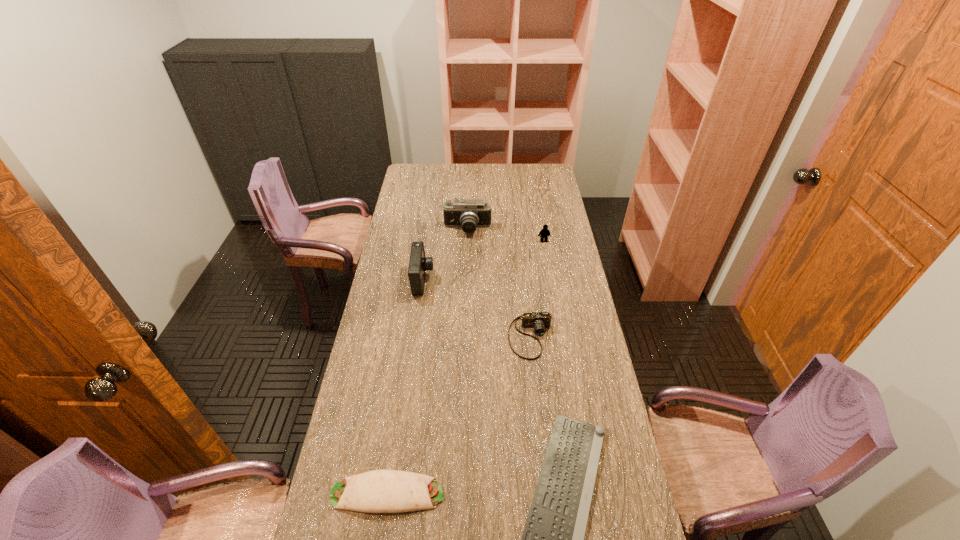
Image resolution: width=960 pixels, height=540 pixels. What are the coordinates of `vacant space situated on the front-facing side of the third farthest object` in the screenshot? It's located at click(503, 280).

Identify the location of free space located 0.340m on the face of the Lego. Image resolution: width=960 pixels, height=540 pixels. pos(553,298).

Identify the location of vacant space situated 0.150m on the front-facing side of the third nearest object. This screenshot has height=540, width=960. (538, 400).

Where is `blank area located at the bitten end of the burrito`? The width and height of the screenshot is (960, 540). blank area located at the bitten end of the burrito is located at coordinates (562, 493).

Locate an element on the screen. The width and height of the screenshot is (960, 540). camera that is at the left edge is located at coordinates (418, 264).

You are a GUI agent. You are given a task and a screenshot of the screen. Output one action in this format:
    pyautogui.click(x=<x>, y=<y>)
    Task: Click on the burrito that is at the left edge
    
    Given the screenshot: What is the action you would take?
    pyautogui.click(x=379, y=491)

At what (x,y) coordinates should I click in order to perform the action: click on Lego positioned at the right edge. Please return your answer as a coordinate pair (x, y). Looking at the image, I should click on (545, 233).

In order to click on camera at the right edge in this screenshot , I will do `click(539, 321)`.

Locate an element on the screen. This screenshot has width=960, height=540. vacant space at the far edge of the desktop is located at coordinates (475, 174).

Identify the location of free spot at the left edge of the desktop. This screenshot has width=960, height=540. (383, 266).